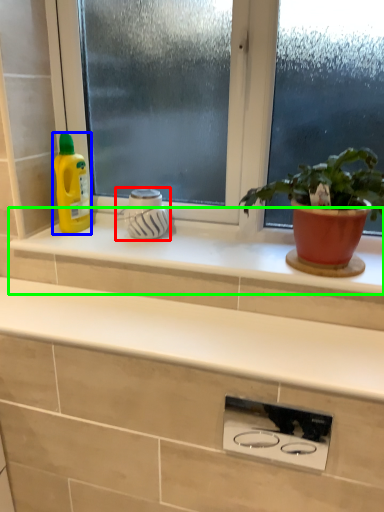
Question: Which object is positioned farthest from appliance (highlighted by a red box)? Select from cleaning product (highlighted by a blue box) and window sill (highlighted by a green box).

Choices:
 (A) cleaning product
 (B) window sill

Answer: (A)